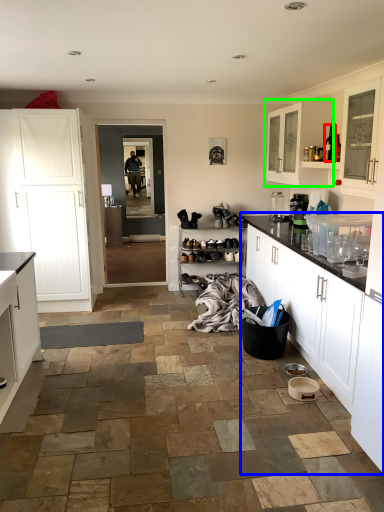
Question: Which object is positioned farthest from bottle (highlighted by a red box)? Select from cabinetry (highlighted by a blue box) and cabinetry (highlighted by a green box).

Choices:
 (A) cabinetry
 (B) cabinetry

Answer: (A)